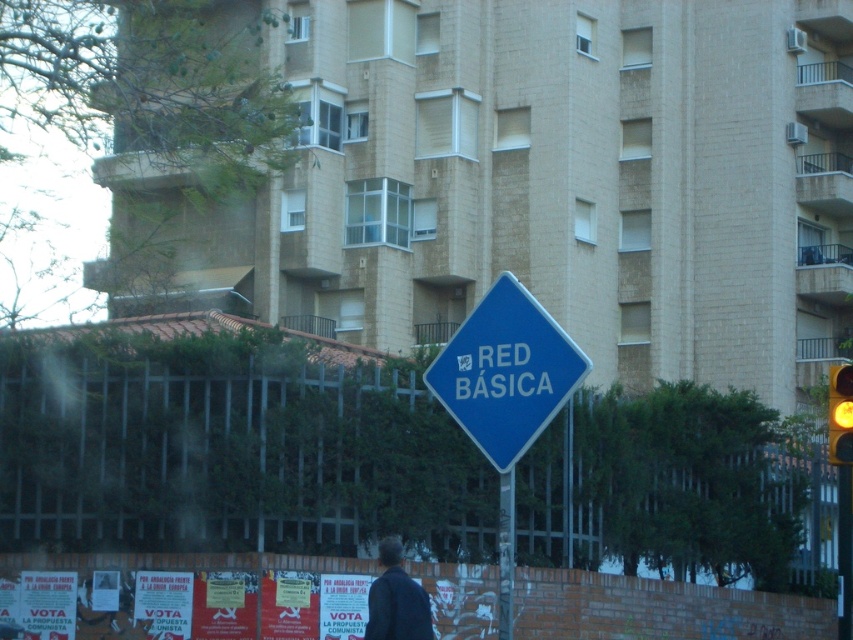
Question: Which of the following is the closest to the observer?

Choices:
 (A) yellow glass traffic light at right
 (B) metallic pole at center
 (C) blue plastic sign at center
 (D) dark blue jacket at lower center

Answer: (C)

Question: Which of the following is the closest to the observer?

Choices:
 (A) metallic pole at center
 (B) blue plastic sign at center
 (C) dark blue jacket at lower center

Answer: (B)

Question: Can you confirm if metallic pole at center is positioned to the right of yellow glass traffic light at right?

Choices:
 (A) no
 (B) yes

Answer: (A)

Question: Which of these objects is positioned closest to the dark blue jacket at lower center?

Choices:
 (A) metallic pole at center
 (B) yellow glass traffic light at right
 (C) blue plastic sign at center

Answer: (A)

Question: Does blue plastic sign at center appear over metallic pole at center?

Choices:
 (A) yes
 (B) no

Answer: (A)

Question: Can you confirm if dark blue jacket at lower center is positioned to the left of metallic pole at center?

Choices:
 (A) yes
 (B) no

Answer: (A)